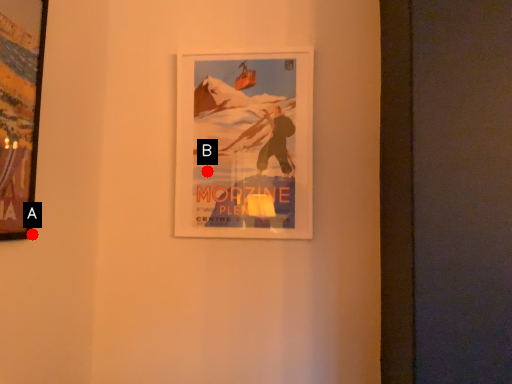
Question: Two points are circled on the image, labeled by A and B beside each circle. Which point is closer to the camera?

Choices:
 (A) A is closer
 (B) B is closer

Answer: (A)